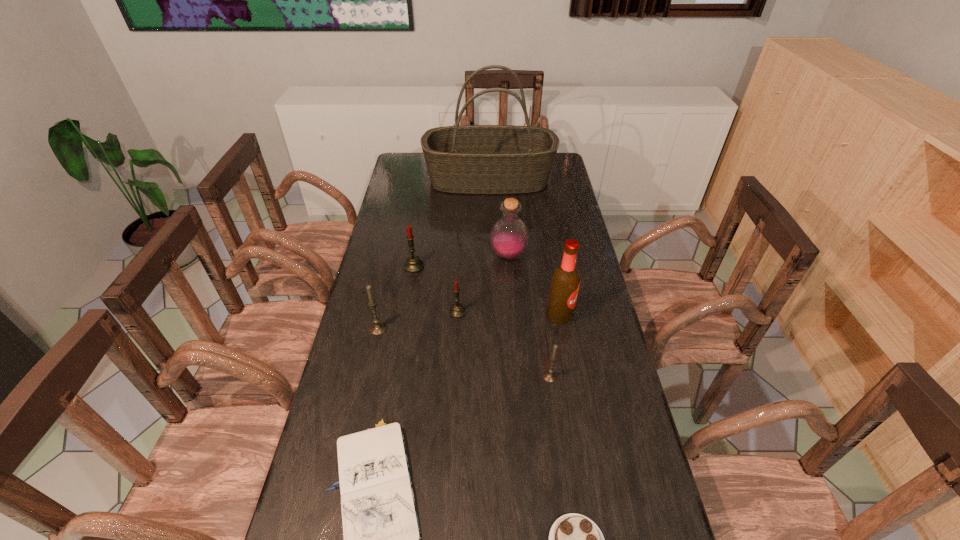
Locate an element on the screen. vacant space that is in between the farthest object and the left gray candle is located at coordinates (434, 254).

The image size is (960, 540). What are the coordinates of `vacant space that is in between the bottle and the tallest object` in the screenshot? It's located at (499, 218).

You are a GUI agent. You are given a task and a screenshot of the screen. Output one action in this format:
    pyautogui.click(x=<x>, y=<y>)
    Task: Click on the unoccupied position between the leftmost candle and the third nearest candle
    The height and width of the screenshot is (540, 960).
    Given the screenshot: What is the action you would take?
    pyautogui.click(x=418, y=320)

Find the location of a particular element. The image size is (960, 540). object that stands as the fourth closest to the bottle is located at coordinates (471, 159).

Locate an element on the screen. The width and height of the screenshot is (960, 540). object that ranks as the seventh closest to the smaller gray candle is located at coordinates coord(413,265).

Locate an element on the screen. The width and height of the screenshot is (960, 540). candle object that ranks as the third closest to the beer bottle is located at coordinates (413, 265).

You are a GUI agent. You are given a task and a screenshot of the screen. Output one action in this format:
    pyautogui.click(x=<x>, y=<y>)
    Task: Click on the candle identified as the second closest to the shortest object
    The image size is (960, 540).
    Given the screenshot: What is the action you would take?
    pyautogui.click(x=550, y=375)

Locate an element on the screen. The height and width of the screenshot is (540, 960). free location that satisfies the following two spatial constraints: 1. on the back side of the smaller red candle; 2. on the right side of the basket is located at coordinates (465, 180).

At what (x,y) coordinates should I click in order to perform the action: click on vacant region that satisfies the following two spatial constraints: 1. on the back side of the farther gray candle; 2. on the right side of the second candle from right to left. Please return your answer as a coordinate pair (x, y). Image resolution: width=960 pixels, height=540 pixels. Looking at the image, I should click on (382, 312).